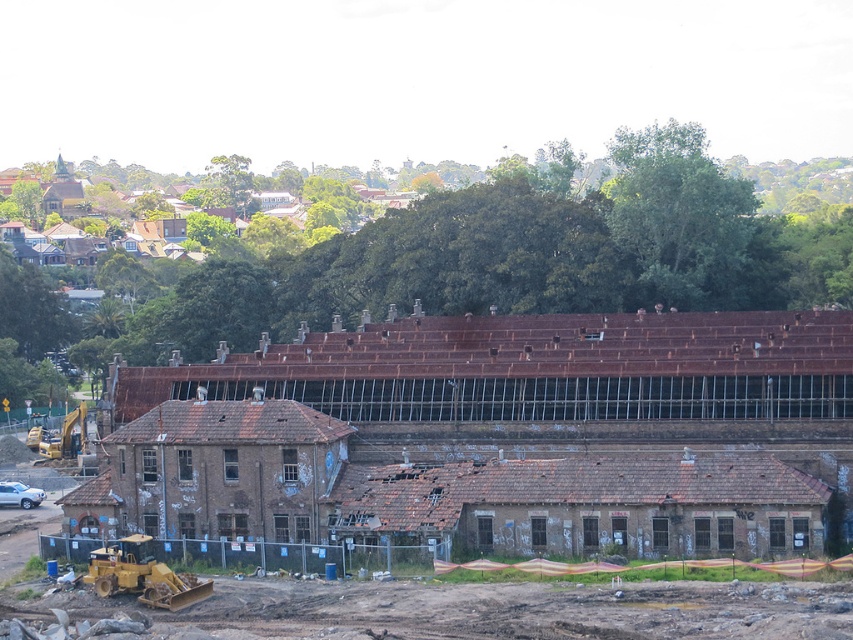
You are a construction worker planning to move the yellow rubber bulldozer at lower left and the yellow metallic excavator at lower left through a narrow alleyway that can only accommodate vehicles narrower than 2 meters. Based on their widths, which one is more likely to fit through the alleyway?

The yellow rubber bulldozer at lower left has a width less than the yellow metallic excavator at lower left, so it is more likely to fit through the alleyway that can only accommodate vehicles narrower than 2 meters.

You are standing at the center of the industrial site and see the point marked at coordinates (142, 573). What object is located at that point?

The point at coordinates (142, 573) indicates the location of the yellow rubber bulldozer at lower left.

You are a construction worker planning to move equipment out of the industrial site. You have to decide which piece of equipment to move first. Based on their sizes, which one should you move first, the yellow rubber bulldozer at lower left or the yellow metallic excavator at lower left?

The yellow rubber bulldozer at lower left should be moved first because it occupies less space than the yellow metallic excavator at lower left, making it easier to maneuver out first.